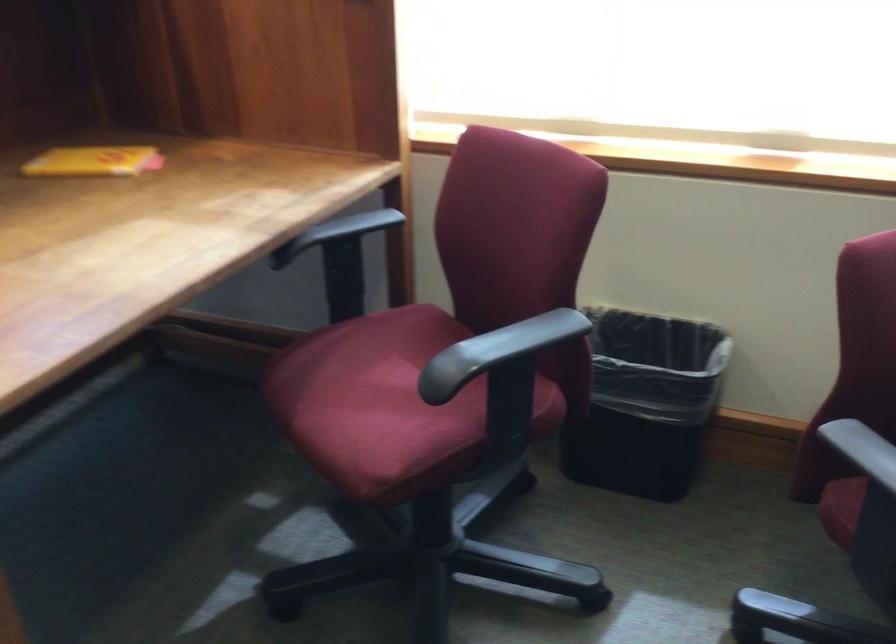
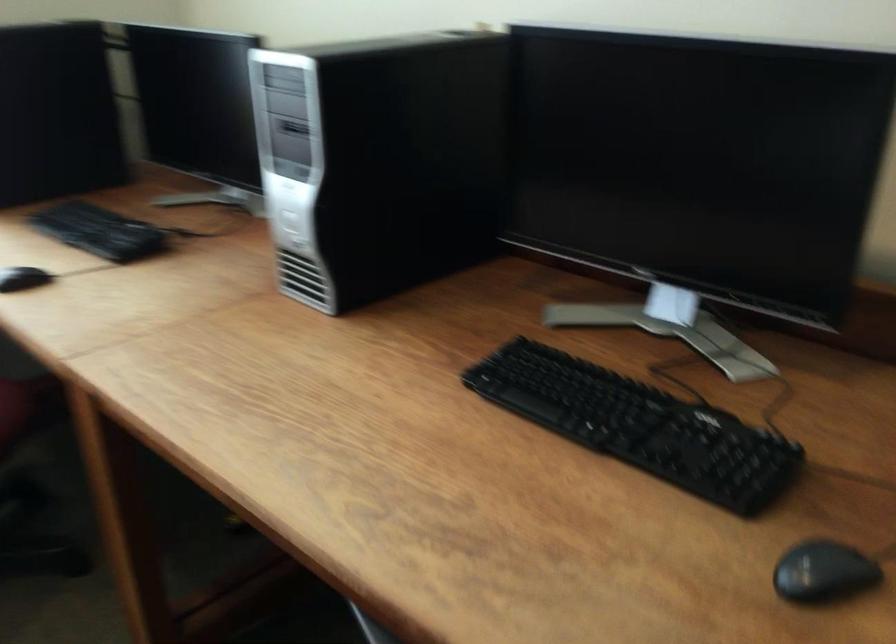
Question: Based on the continuous images, in which direction is the camera rotating? Reply with the corresponding letter.

Choices:
 (A) Left
 (B) Right
 (C) Up
 (D) Down

Answer: (B)